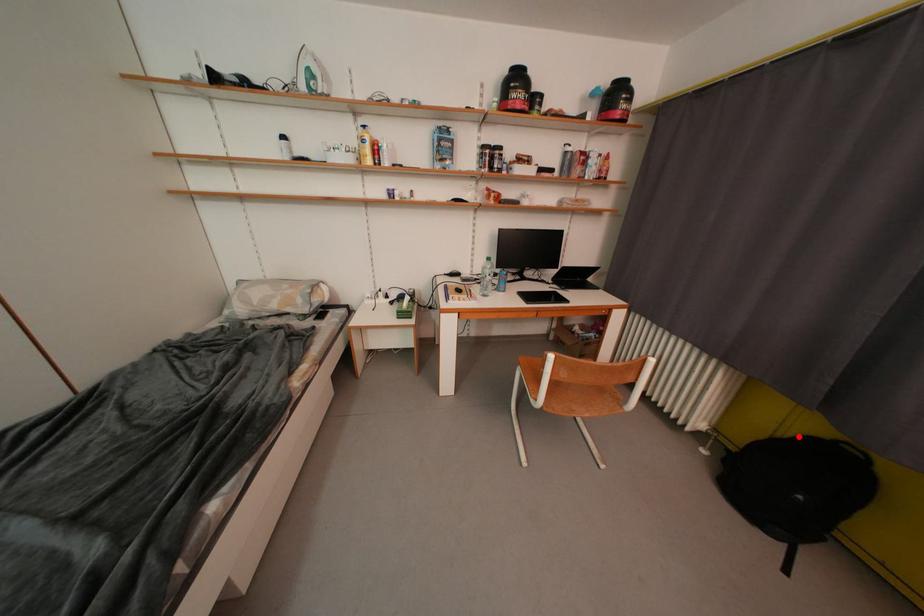
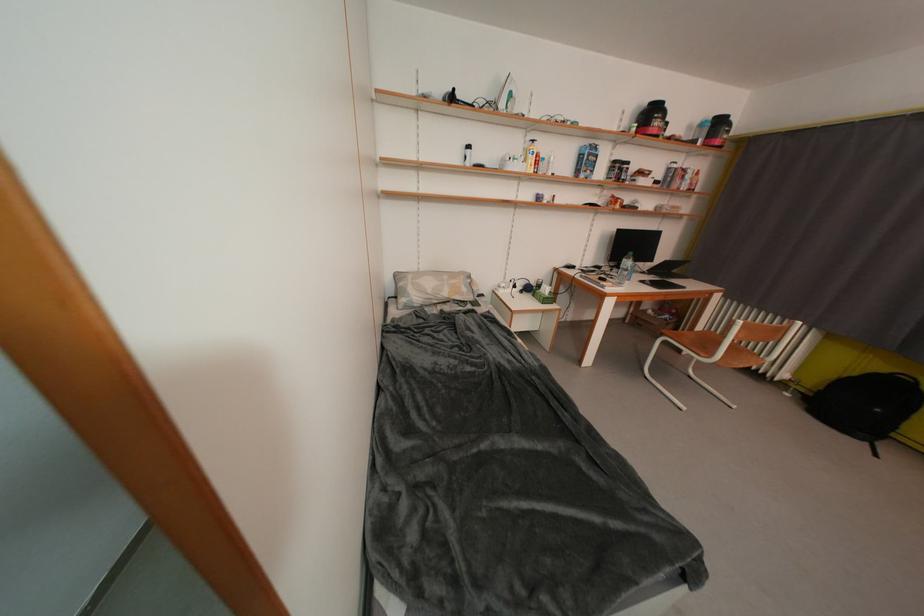
The point at the highlighted location is marked in the first image. Where is the corresponding point in the second image?

(862, 377)